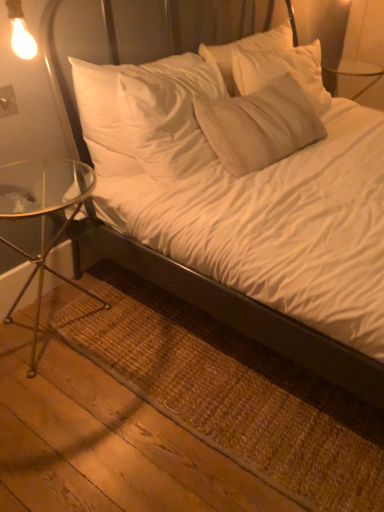
This screenshot has height=512, width=384. I want to click on vacant region under clear glass table at left (from a real-world perspective), so click(50, 328).